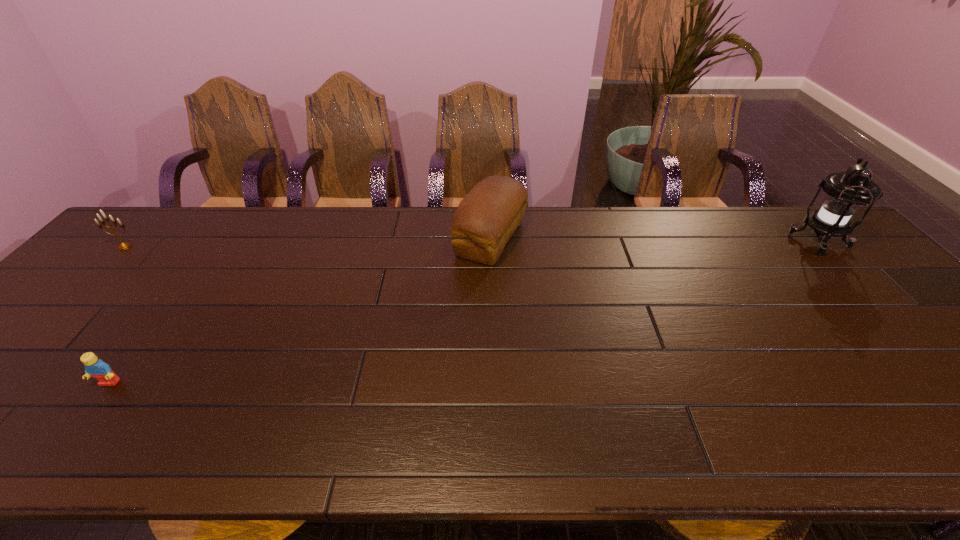
At what (x,y) coordinates should I click in order to perform the action: click on free space at the left edge. Please return your answer as a coordinate pair (x, y). Looking at the image, I should click on (84, 308).

Locate an element on the screen. This screenshot has width=960, height=540. vacant space at the right edge of the desktop is located at coordinates (875, 330).

Locate an element on the screen. free region at the far right corner of the desktop is located at coordinates (801, 251).

At what (x,y) coordinates should I click in order to perform the action: click on vacant region between the bread and the leftmost object. Please return your answer as a coordinate pair (x, y). This screenshot has height=540, width=960. Looking at the image, I should click on (307, 243).

Where is `free space between the tallest object and the third object from left to right`? free space between the tallest object and the third object from left to right is located at coordinates 655,241.

You are a GUI agent. You are given a task and a screenshot of the screen. Output one action in this format:
    pyautogui.click(x=<x>, y=<y>)
    Task: Click on the free space between the tallest object and the Lego
    This screenshot has width=960, height=540.
    Given the screenshot: What is the action you would take?
    pyautogui.click(x=464, y=313)

The width and height of the screenshot is (960, 540). I want to click on vacant region between the candelabrum and the bread, so click(307, 243).

Identify the location of free space that is in between the rightmost object and the second object from right to left. (655, 241).

Identify the location of empty location between the Lego and the candelabrum. (117, 315).

Locate an element on the screen. vacant region between the second tallest object and the rightmost object is located at coordinates (655, 241).